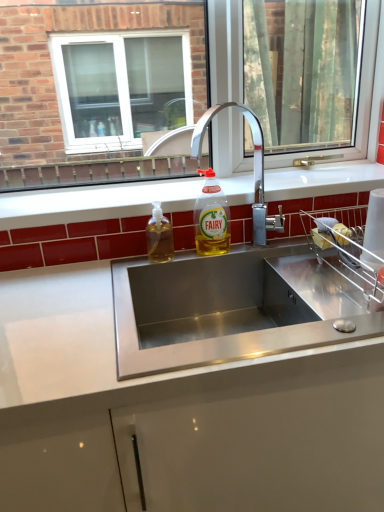
Question: Is the position of chrome metallic faucet at center more distant than that of clear glass window at center?

Choices:
 (A) no
 (B) yes

Answer: (A)

Question: Does chrome metallic faucet at center have a lesser height compared to clear glass window at center?

Choices:
 (A) yes
 (B) no

Answer: (A)

Question: Is clear glass window at center at the back of chrome metallic faucet at center?

Choices:
 (A) yes
 (B) no

Answer: (A)

Question: Would you say chrome metallic faucet at center is a long distance from clear glass window at center?

Choices:
 (A) no
 (B) yes

Answer: (B)

Question: Considering the relative sizes of chrome metallic faucet at center and clear glass window at center in the image provided, is chrome metallic faucet at center bigger than clear glass window at center?

Choices:
 (A) no
 (B) yes

Answer: (A)

Question: In terms of size, does clear glass window at center appear bigger or smaller than translucent plastic soap dispenser at sink left, which appears as the 1th bottle when viewed from the left?

Choices:
 (A) small
 (B) big

Answer: (B)

Question: From the image's perspective, is clear glass window at center above or below translucent plastic soap dispenser at sink left, which appears as the 1th bottle when viewed from the left?

Choices:
 (A) above
 (B) below

Answer: (A)

Question: Which is correct: clear glass window at center is inside translucent plastic soap dispenser at sink left, which appears as the 1th bottle when viewed from the left, or outside of it?

Choices:
 (A) outside
 (B) inside

Answer: (A)

Question: Looking at their shapes, would you say clear glass window at center is wider or thinner than translucent plastic soap dispenser at sink left, the 2th bottle in the right-to-left sequence?

Choices:
 (A) thin
 (B) wide

Answer: (A)

Question: From the image's perspective, relative to white glossy countertop at center, is yellow translucent liquid at sink center, which appears as the first bottle when viewed from the right, above or below?

Choices:
 (A) below
 (B) above

Answer: (B)

Question: Would you say yellow translucent liquid at sink center, which appears as the first bottle when viewed from the right, is inside or outside white glossy countertop at center?

Choices:
 (A) outside
 (B) inside

Answer: (A)

Question: Considering the positions of yellow translucent liquid at sink center, which ranks as the 2th bottle in left-to-right order, and white glossy countertop at center in the image, is yellow translucent liquid at sink center, which ranks as the 2th bottle in left-to-right order, bigger or smaller than white glossy countertop at center?

Choices:
 (A) big
 (B) small

Answer: (B)

Question: Is yellow translucent liquid at sink center, which ranks as the 2th bottle in left-to-right order, in front of or behind white glossy countertop at center in the image?

Choices:
 (A) front
 (B) behind

Answer: (B)

Question: Which is correct: stainless steel sink at center is inside translucent plastic soap dispenser at sink left, the 2th bottle in the right-to-left sequence, or outside of it?

Choices:
 (A) inside
 (B) outside

Answer: (B)

Question: Considering their positions, is stainless steel sink at center located in front of or behind translucent plastic soap dispenser at sink left, which appears as the 1th bottle when viewed from the left?

Choices:
 (A) front
 (B) behind

Answer: (A)